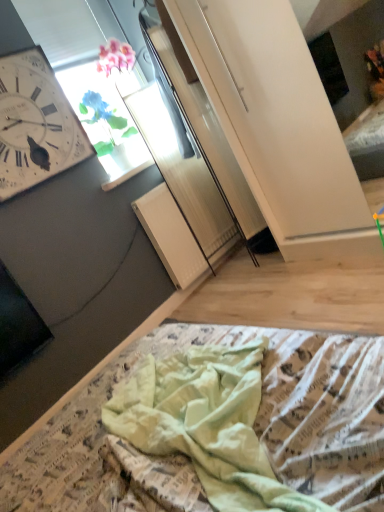
Question: From a real-world perspective, is white wooden wall clock at upper left above or below transparent glass window at upper center?

Choices:
 (A) above
 (B) below

Answer: (A)

Question: Considering the positions of white wooden wall clock at upper left and transparent glass window at upper center in the image, is white wooden wall clock at upper left wider or thinner than transparent glass window at upper center?

Choices:
 (A) wide
 (B) thin

Answer: (B)

Question: Which object is the farthest from the transparent glass window at upper center?

Choices:
 (A) light green fabric at lower center
 (B) white wooden wall clock at upper left

Answer: (A)

Question: Which object is the farthest from the transparent glass window at upper center?

Choices:
 (A) light green fabric at lower center
 (B) white wooden wall clock at upper left

Answer: (A)